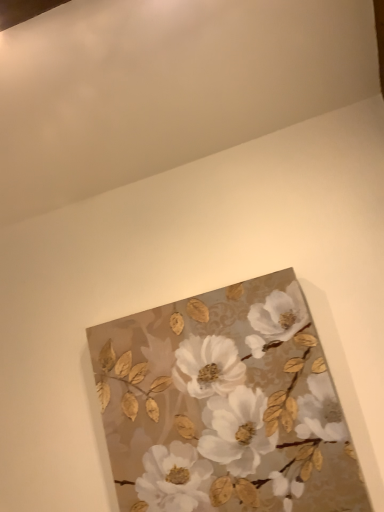
Where is `gold textured leaves and flowers at center`? gold textured leaves and flowers at center is located at coordinates (228, 400).

Describe the element at coordinates (228, 400) in the screenshot. I see `gold textured leaves and flowers at center` at that location.

Identify the location of gold textured leaves and flowers at center. (228, 400).